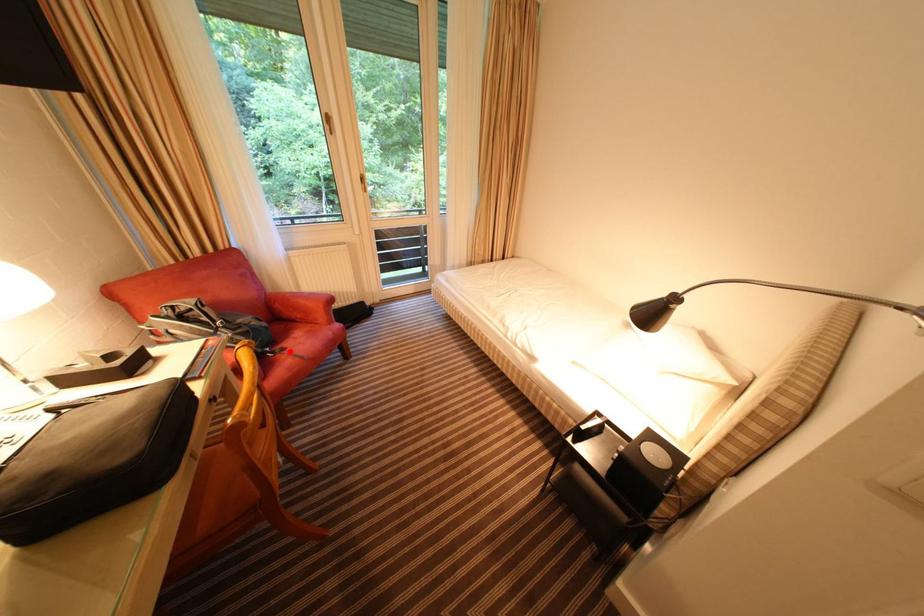
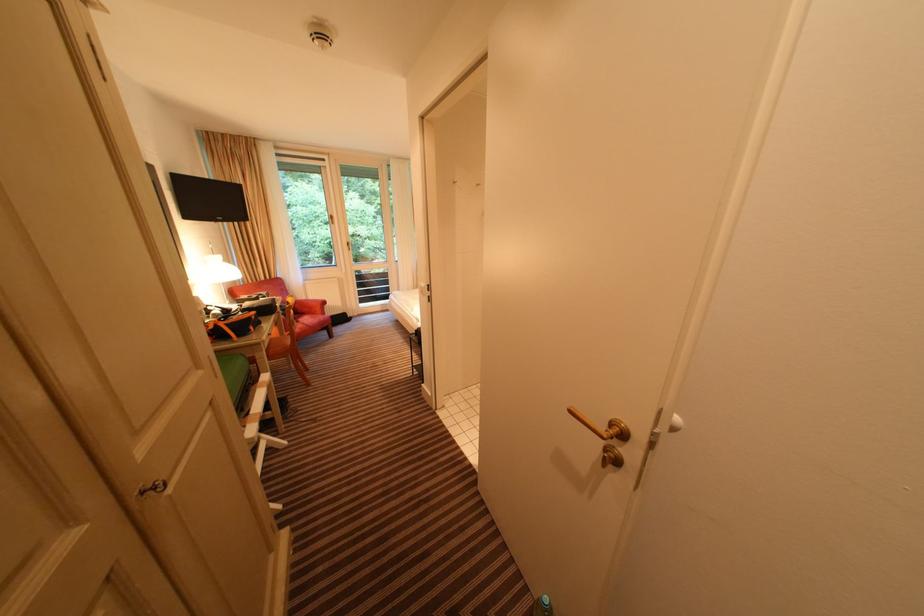
Locate, in the second image, the point that corresponds to the highlighted location in the first image.

(305, 323)